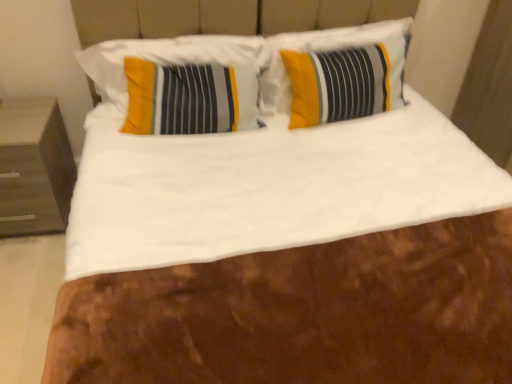
Question: Looking at their shapes, would you say yellow fabric pillow at center, marked as the second pillow in a left-to-right arrangement, is wider or thinner than dark wood nightstand at left?

Choices:
 (A) thin
 (B) wide

Answer: (A)

Question: From the image's perspective, is yellow fabric pillow at center, marked as the second pillow in a left-to-right arrangement, located above or below dark wood nightstand at left?

Choices:
 (A) below
 (B) above

Answer: (B)

Question: Which object is positioned closest to the yellow striped pillow at upper left, the first pillow positioned from the left?

Choices:
 (A) yellow fabric pillow at center, marked as the second pillow in a left-to-right arrangement
 (B) dark wood nightstand at left

Answer: (A)

Question: Which object is positioned closest to the yellow striped pillow at upper left, the 2th pillow positioned from the right?

Choices:
 (A) dark wood nightstand at left
 (B) yellow fabric pillow at center, marked as the second pillow in a left-to-right arrangement

Answer: (B)